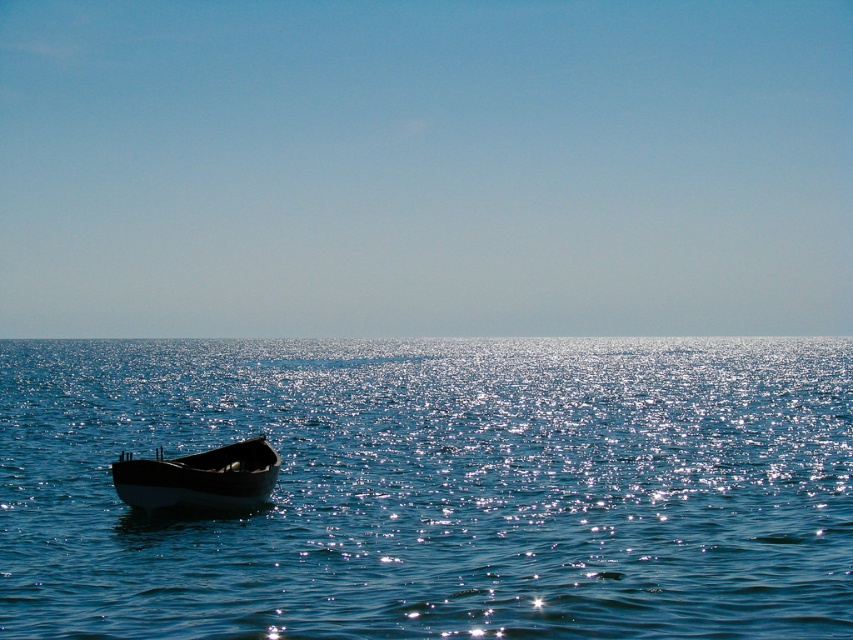
Question: Can you confirm if glistening blue water at center is positioned below wooden boat at lower left?

Choices:
 (A) no
 (B) yes

Answer: (B)

Question: Which object appears closest to the camera in this image?

Choices:
 (A) wooden boat at lower left
 (B) glistening blue water at center

Answer: (B)

Question: Considering the relative positions of glistening blue water at center and wooden boat at lower left in the image provided, where is glistening blue water at center located with respect to wooden boat at lower left?

Choices:
 (A) left
 (B) right

Answer: (B)

Question: Does glistening blue water at center lie behind wooden boat at lower left?

Choices:
 (A) no
 (B) yes

Answer: (A)